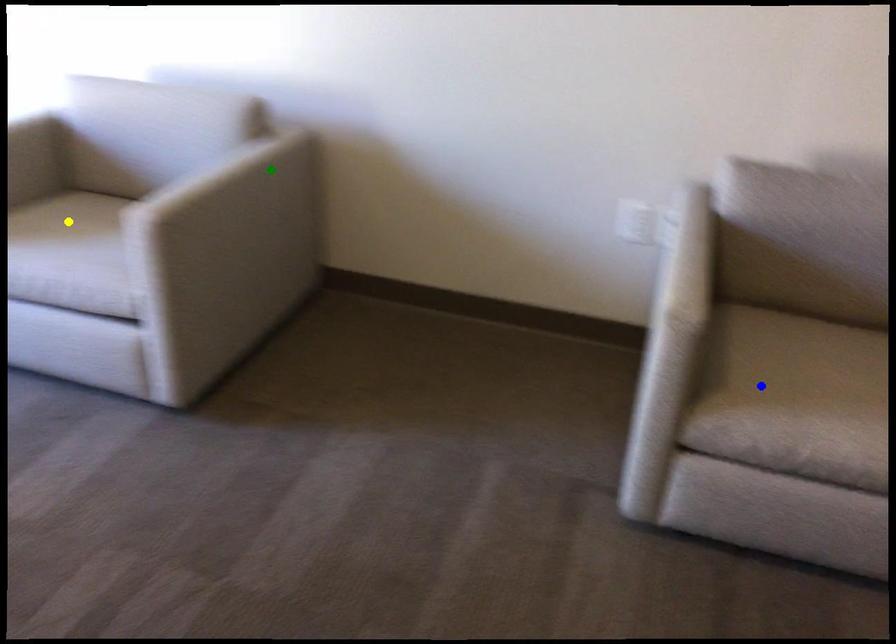
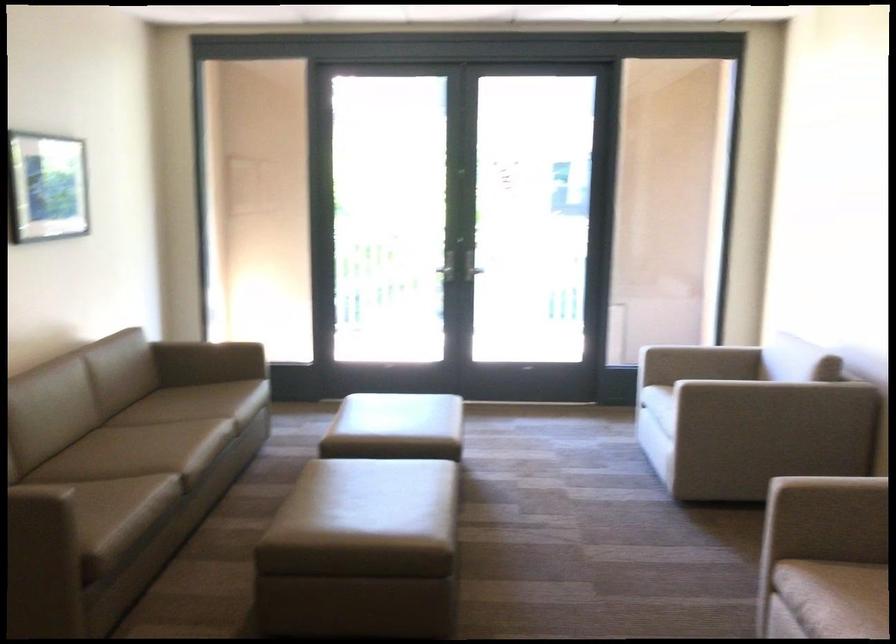
I am providing you with two images of the same scene from different viewpoints. Three points are marked in image1. Which point corresponds to a part or object that is occluded in image2?In image1, three points are marked. Which of them correspond to a part or object that is occluded in image2?Among the three points shown in image1, which one corresponds to a part or object that is no longer visible due to occlusion in image2?

Invisible in image2: yellow point.